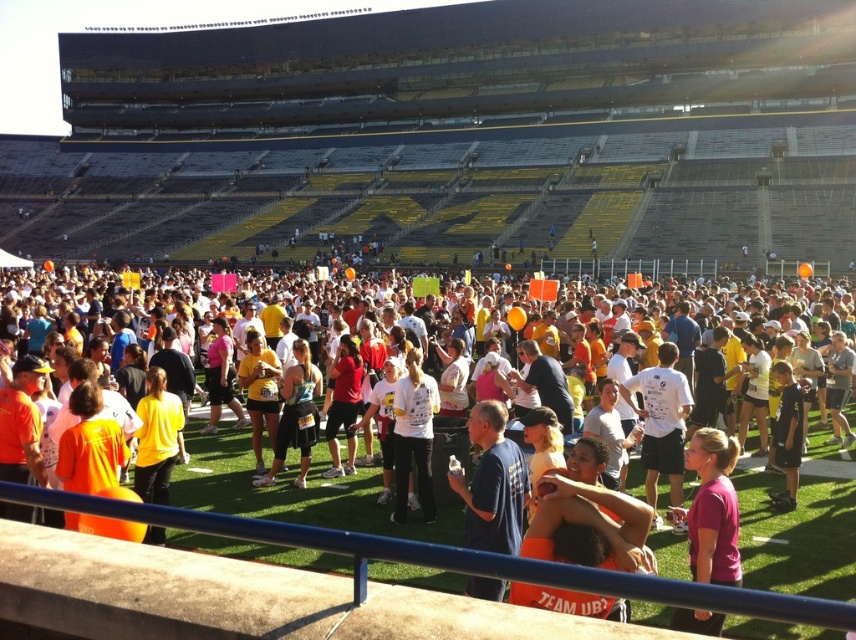
You are standing at the origin point of the coordinate system where the blue cotton shirt at center is located at point 0.756, 0.577. If you move 0.2 units to the right, will you be closer to the edge of the image?

The blue cotton shirt at center is located at point (492, 483). Moving 0.2 units to the right would bring you to 0.956 on the x coordinate, which is near the edge of the image. Therefore, you will be closer to the edge of the image.

You are standing at the edge of the stadium field and want to reach a specific point marked at coordinates point (518, 509). If you can walk 4 feet per second, how many seconds will it take you to reach that point?

The distance of point (518, 509) from viewer is 33.47 feet. At a walking speed of 4 feet per second, it would take approximately 8.37 seconds to reach the point.